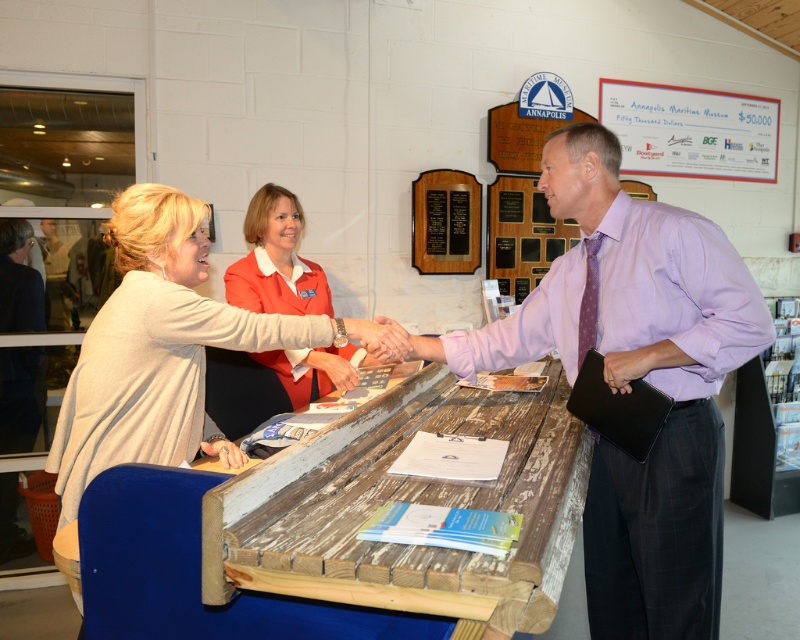
You are planning to take a photo of the purple shirt at center and the light beige sweater at center at the Annapolis Maritime Museum. Which one should you focus on first if you want to capture both in the frame without zooming in too much?

The purple shirt at center has a larger size compared to the light beige sweater at center, so you should focus on the purple shirt at center first to ensure it fits well in the frame before adjusting for the smaller light beige sweater at center.

From the picture: You are a visitor at the Annapolis Maritime Museum. You see a weathered wood table at center and a light beige sweater at center. Which object is closer to you?

The weathered wood table at center is closer to you because it is in front of the light beige sweater at center.